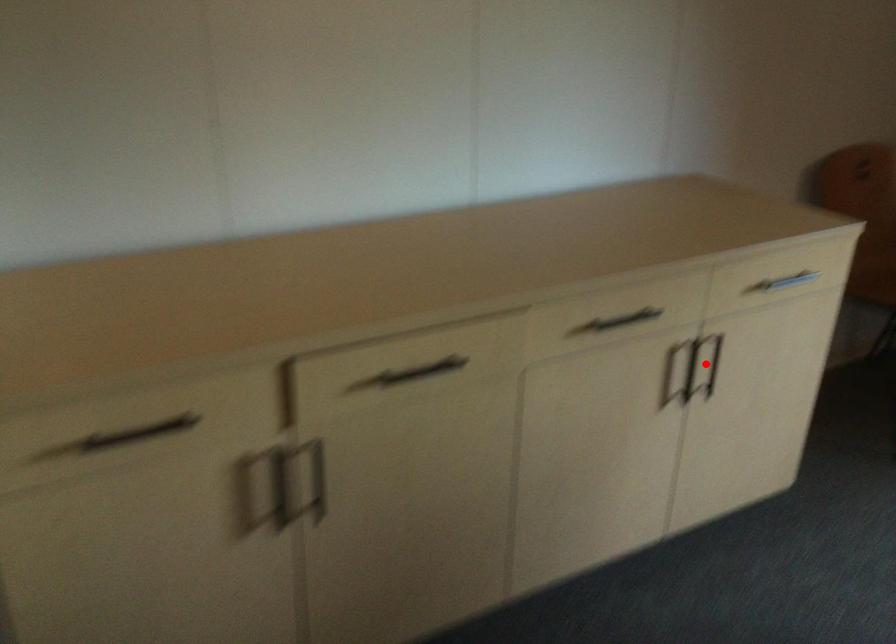
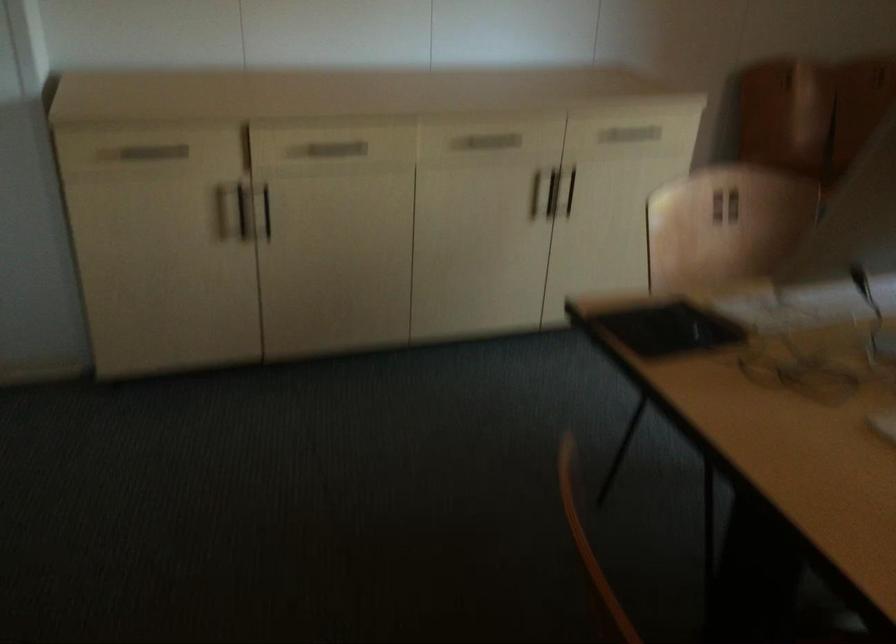
Where in the second image is the point corresponding to the highlighted location from the first image?

(570, 192)